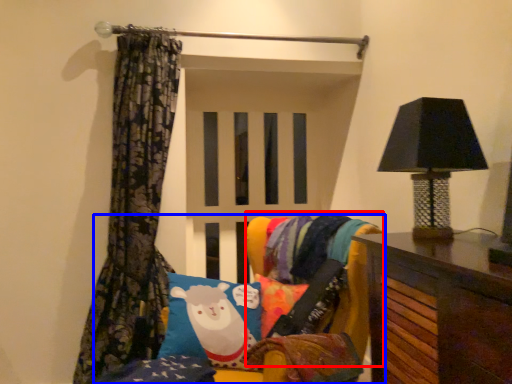
Question: Which point is closer to the camera, bean bag chair (highlighted by a red box) or furniture (highlighted by a blue box)?

Choices:
 (A) bean bag chair
 (B) furniture

Answer: (B)